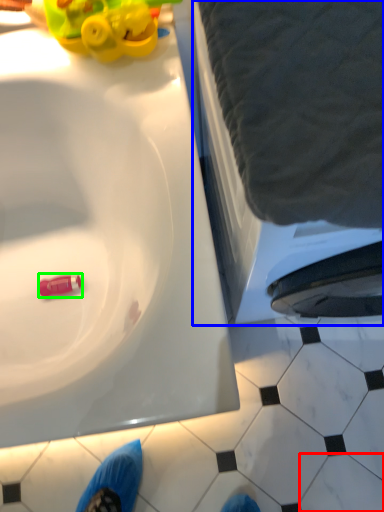
Question: Which object is the farthest from tile (highlighted by a red box)? Choose among these: bath (highlighted by a blue box) or toy (highlighted by a green box).

Choices:
 (A) bath
 (B) toy

Answer: (B)